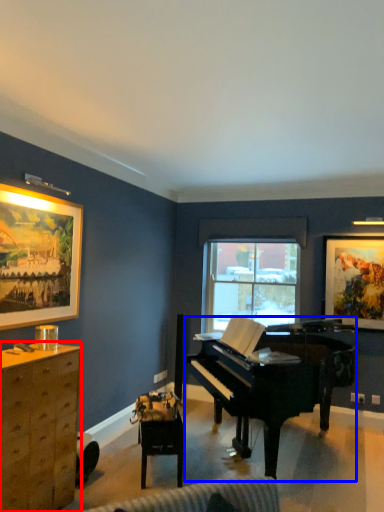
Question: Among these objects, which one is farthest to the camera, cabinetry (highlighted by a red box) or piano (highlighted by a blue box)?

Choices:
 (A) cabinetry
 (B) piano

Answer: (B)